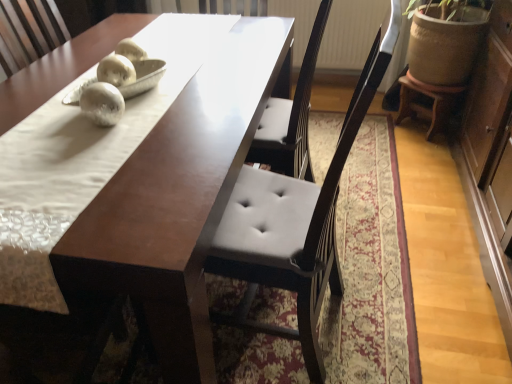
Question: Is matte brown table at center surrounding wooden stool at right?

Choices:
 (A) no
 (B) yes

Answer: (A)

Question: Is matte brown table at center shorter than wooden stool at right?

Choices:
 (A) no
 (B) yes

Answer: (A)

Question: Can we say matte brown table at center lies outside wooden stool at right?

Choices:
 (A) yes
 (B) no

Answer: (A)

Question: From the image's perspective, is matte brown table at center below wooden stool at right?

Choices:
 (A) yes
 (B) no

Answer: (A)

Question: Are matte brown table at center and wooden stool at right making contact?

Choices:
 (A) yes
 (B) no

Answer: (B)

Question: Considering the relative positions of wooden stool at right and white fabric mat at center in the image provided, is wooden stool at right to the left or to the right of white fabric mat at center?

Choices:
 (A) right
 (B) left

Answer: (A)

Question: Looking at the image, does wooden stool at right seem bigger or smaller compared to white fabric mat at center?

Choices:
 (A) big
 (B) small

Answer: (B)

Question: From a real-world perspective, is wooden stool at right above or below white fabric mat at center?

Choices:
 (A) above
 (B) below

Answer: (B)

Question: In the image, is wooden stool at right positioned in front of or behind white fabric mat at center?

Choices:
 (A) behind
 (B) front

Answer: (A)

Question: Considering the relative positions of wooden stool at right and matte brown table at center in the image provided, is wooden stool at right to the left or to the right of matte brown table at center?

Choices:
 (A) right
 (B) left

Answer: (A)

Question: In the image, is wooden stool at right positioned in front of or behind matte brown table at center?

Choices:
 (A) behind
 (B) front

Answer: (A)

Question: From a real-world perspective, is wooden stool at right positioned above or below matte brown table at center?

Choices:
 (A) below
 (B) above

Answer: (A)

Question: From the image's perspective, is wooden stool at right positioned above or below matte brown table at center?

Choices:
 (A) above
 (B) below

Answer: (A)

Question: Do you think matte brown table at center is within white fabric mat at center, or outside of it?

Choices:
 (A) inside
 (B) outside

Answer: (B)

Question: Looking at the image, does matte brown table at center seem bigger or smaller compared to white fabric mat at center?

Choices:
 (A) big
 (B) small

Answer: (A)